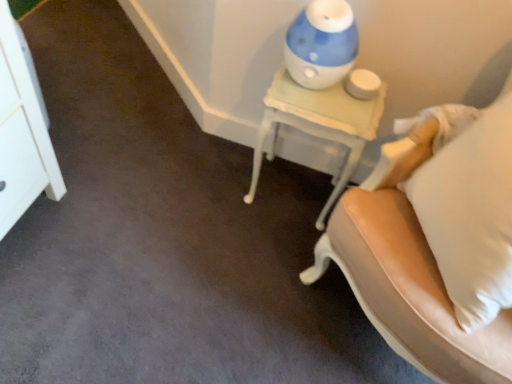
Where is `vacant area situated to the left side of white painted wood nightstand at upper right`? The height and width of the screenshot is (384, 512). vacant area situated to the left side of white painted wood nightstand at upper right is located at coordinates (209, 180).